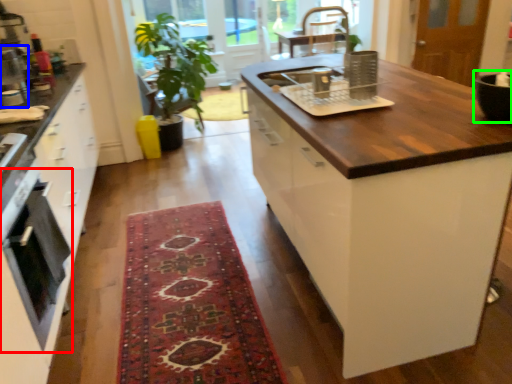
Question: Which object is positioned farthest from oven (highlighted by a red box)? Select from appliance (highlighted by a blue box) and appliance (highlighted by a green box).

Choices:
 (A) appliance
 (B) appliance

Answer: (B)